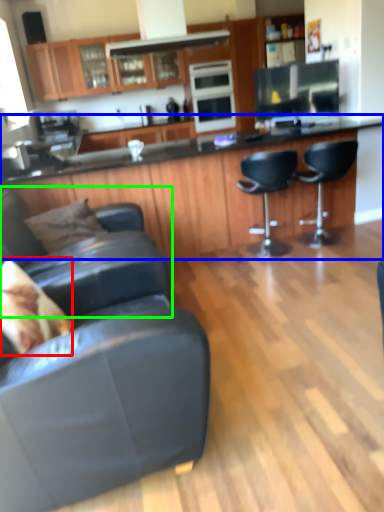
Question: Considering the real-world distances, which object is closest to pillow (highlighted by a red box)? countertop (highlighted by a blue box) or chair (highlighted by a green box).

Choices:
 (A) countertop
 (B) chair

Answer: (B)